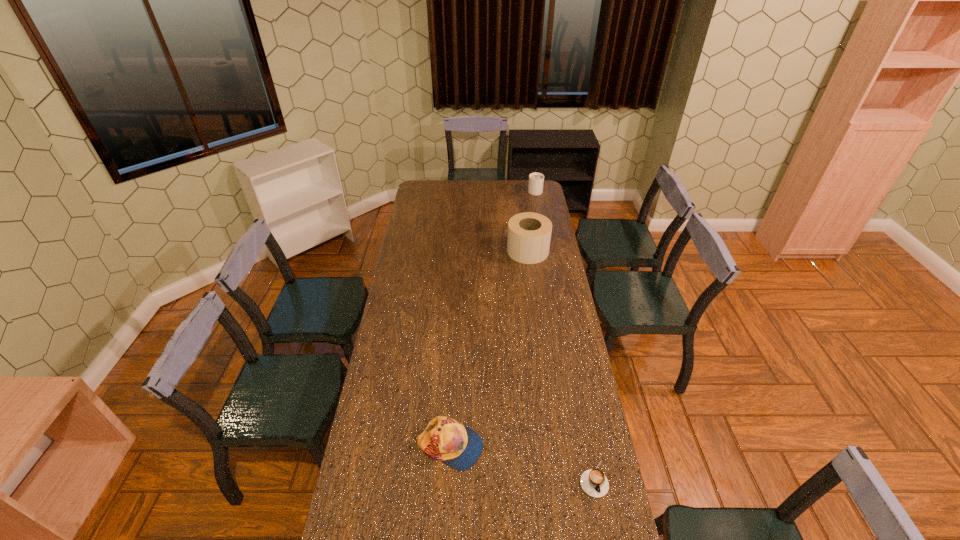
Where is `vacant region between the leftmost object and the toilet tissue`? The width and height of the screenshot is (960, 540). vacant region between the leftmost object and the toilet tissue is located at coordinates (489, 349).

I want to click on empty space that is in between the toilet tissue and the shorter cappuccino, so click(x=561, y=364).

Locate an element on the screen. The height and width of the screenshot is (540, 960). vacant space in between the shortest object and the leftmost object is located at coordinates (521, 463).

What are the coordinates of `free point between the cap and the farther cappuccino` in the screenshot? It's located at (492, 318).

Select which object is the third closest to the cap. Please provide its 2D coordinates. Your answer should be formatted as a tuple, i.e. [(x, y)], where the tuple contains the x and y coordinates of a point satisfying the conditions above.

[(536, 180)]

Identify which object is located as the second nearest to the second farthest object. Please provide its 2D coordinates. Your answer should be formatted as a tuple, i.e. [(x, y)], where the tuple contains the x and y coordinates of a point satisfying the conditions above.

[(445, 439)]

Locate an element on the screen. This screenshot has height=540, width=960. cappuccino that is the nearest to the tallest object is located at coordinates (536, 180).